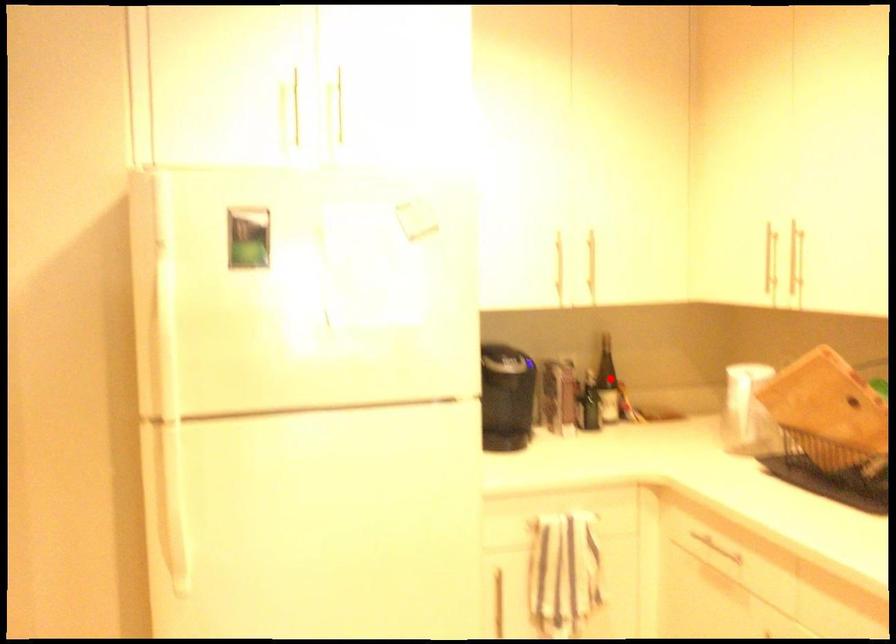
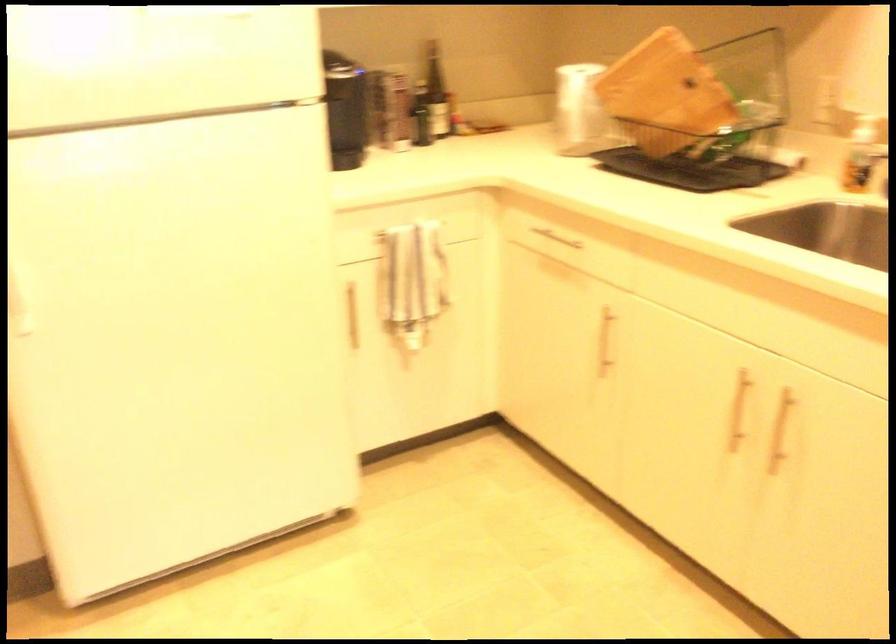
Find the pixel in the second image that matches the highlighted location in the first image.

(435, 91)